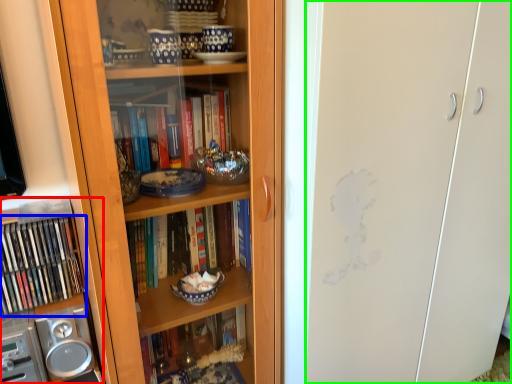
Question: Considering the real-world distances, which object is closest to cabinet (highlighted by a red box)? book (highlighted by a blue box) or glass door (highlighted by a green box).

Choices:
 (A) book
 (B) glass door

Answer: (A)